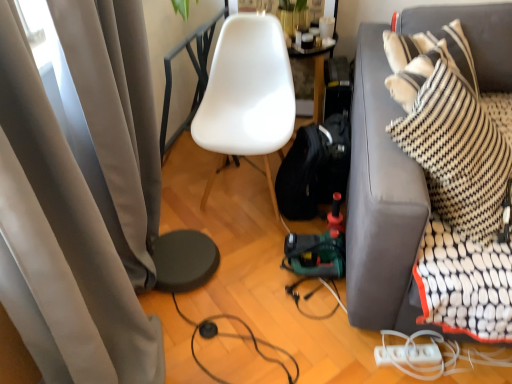
Where is `vacant space underneath white matte chair at center (from a real-world perspective)`? The image size is (512, 384). vacant space underneath white matte chair at center (from a real-world perspective) is located at coordinates (240, 198).